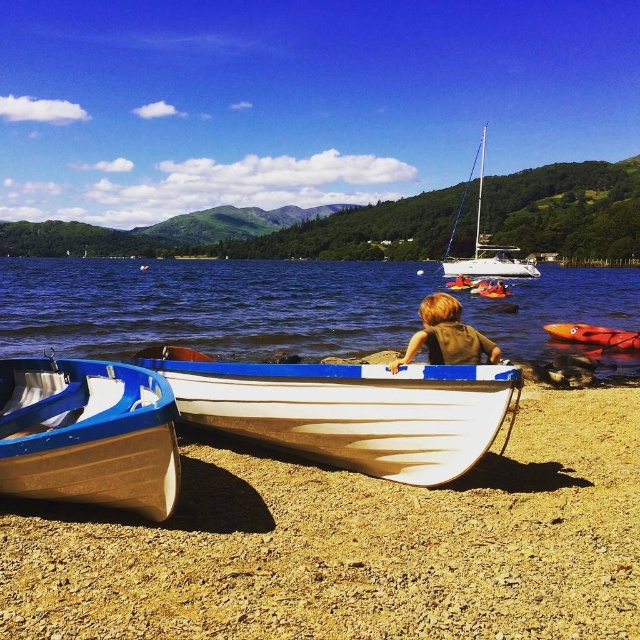
Question: Is brown fabric shirt at center smaller than white glossy kayak at center?

Choices:
 (A) no
 (B) yes

Answer: (B)

Question: Does blue water at center appear under white glossy boat at center?

Choices:
 (A) no
 (B) yes

Answer: (A)

Question: Which object is positioned farthest from the white glossy sailboat at upper center?

Choices:
 (A) white glossy kayak at center
 (B) wooden boat at lower center
 (C) orange plastic kayak at center
 (D) matte white boat at lower left

Answer: (B)

Question: Considering the real-world distances, which object is farthest from the white glossy sailboat at upper center?

Choices:
 (A) wooden boat at lower center
 (B) white glossy boat at center
 (C) matte white boat at lower left
 (D) white glossy kayak at center

Answer: (A)

Question: Is white glossy sailboat at upper center positioned in front of white glossy kayak at center?

Choices:
 (A) no
 (B) yes

Answer: (A)

Question: Among these points, which one is farthest from the camera?

Choices:
 (A) (26, 392)
 (B) (577, 339)
 (C) (132, 588)

Answer: (B)